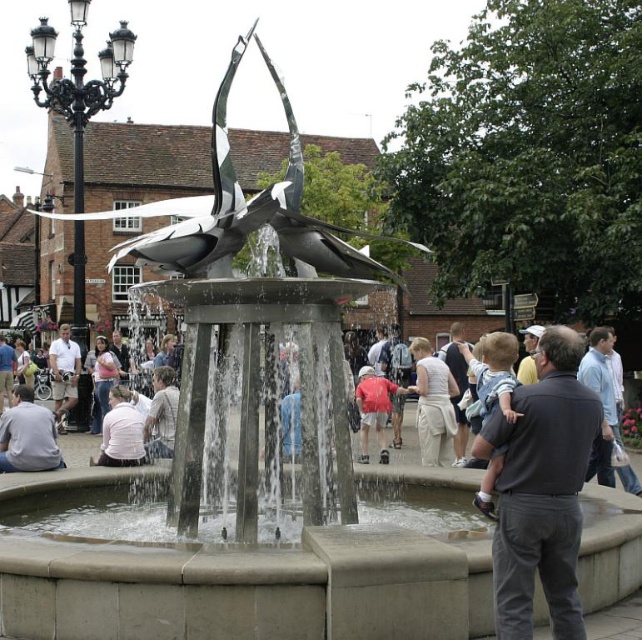
You are a photographer at the public square and want to capture both the light beige cotton dress at center and the light pink shirt at center in a single shot. Based on their positions, which one should you focus on first to ensure both are in frame?

You should focus on the light pink shirt at center first because the light beige cotton dress at center is to the right of it, so by centering the light pink shirt at center, the light beige cotton dress at center will naturally fall into the frame to its right side.

You are standing at the point labeled as point (541, 490) in the image. What is the nearest object to you in the scene?

The nearest object to you at point (541, 490) is the dark gray suit at center.